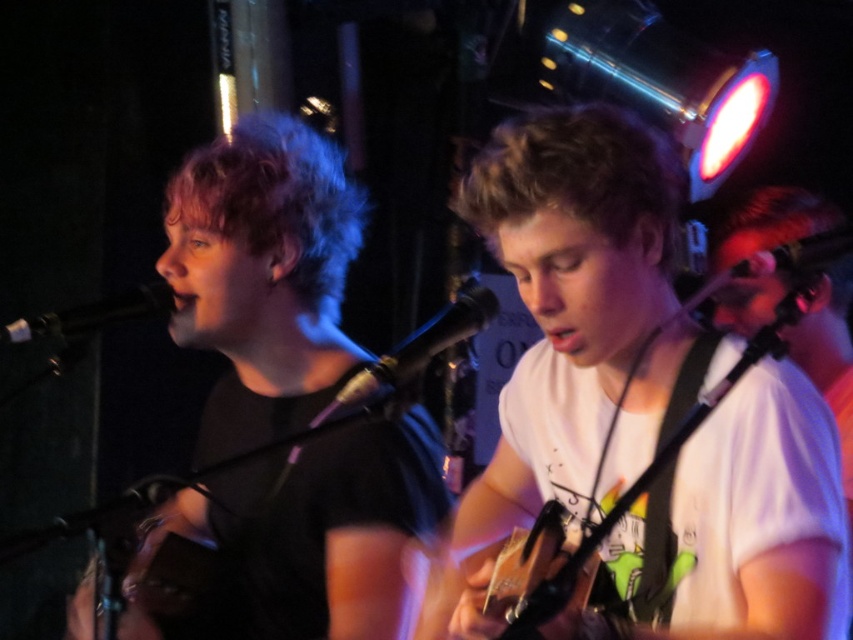
Question: Is white matte guitar at center positioned in front of metallic silver microphone at upper right?

Choices:
 (A) yes
 (B) no

Answer: (A)

Question: Observing the image, what is the correct spatial positioning of white matte guitar at center in reference to black metallic microphone at center?

Choices:
 (A) above
 (B) below

Answer: (B)

Question: Can you confirm if white matte guitar at center is wider than black metallic microphone at center?

Choices:
 (A) yes
 (B) no

Answer: (A)

Question: Which object is the farthest from the metallic silver microphone at upper right?

Choices:
 (A) wooden acoustic guitar at center
 (B) black metallic microphone at center

Answer: (A)

Question: Which of the following is the farthest from the observer?

Choices:
 (A) (537, 595)
 (B) (13, 332)
 (C) (611, 288)

Answer: (B)

Question: Which of the following is the farthest from the observer?

Choices:
 (A) black metallic microphone at left
 (B) wooden acoustic guitar at center
 (C) white matte guitar at center

Answer: (A)